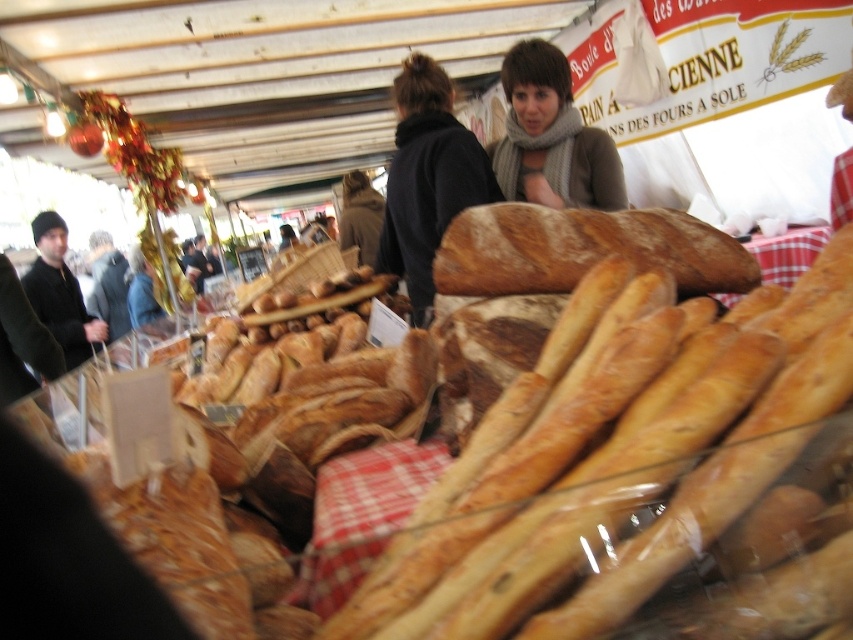
You are a customer at the market stall and want to pick up the golden brown crusty baguette at center. However, you notice the black woolen sweater at upper center is in the way. Can you reach the baguette without moving the sweater?

The golden brown crusty baguette at center is positioned under the black woolen sweater at upper center, so you can reach the baguette by moving your hand under the sweater without needing to move it aside.

You are a customer at the market stall and want to buy the golden brown crusty baguette at center. The baguette is displayed under a glass cover. Can you reach it directly from your current position, which is at point (613, 460)?

The point (613, 460) indicates the golden brown crusty baguette at center, so you are already at the location of the baguette. Therefore, you can reach it directly.

You are a customer at the market stall and want to pick up the golden brown crusty baguette at center. However, there is a person wearing a black knit hat at left blocking your view. Can you reach the baguette without moving the person?

The golden brown crusty baguette at center is in front of the black knit hat at left, so you can reach the baguette without moving the person since it is already in front of them.